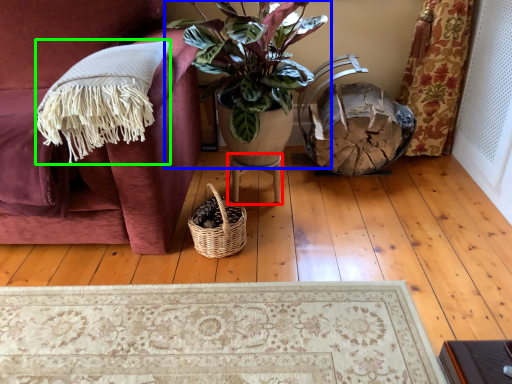
Question: Which is farther away from table (highlighted by a red box)? houseplant (highlighted by a blue box) or blanket (highlighted by a green box)?

Choices:
 (A) houseplant
 (B) blanket

Answer: (B)